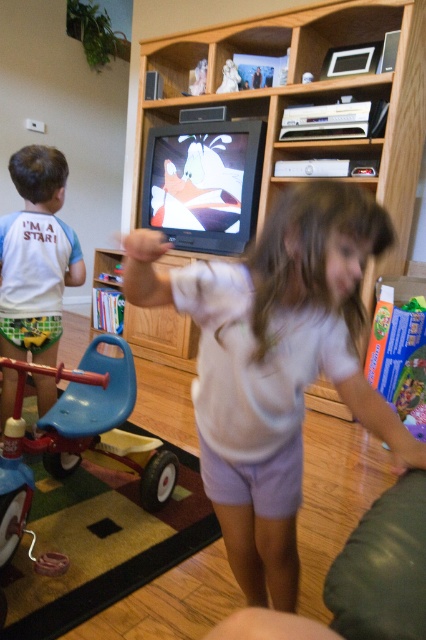
Is blue plastic tricycle at lower left positioned behind white cotton shirt at left?

No, blue plastic tricycle at lower left is in front of white cotton shirt at left.

Is blue plastic tricycle at lower left to the right of white cotton shirt at left from the viewer's perspective?

Indeed, blue plastic tricycle at lower left is positioned on the right side of white cotton shirt at left.

Find the location of `blue plastic tricycle at lower left`. blue plastic tricycle at lower left is located at coordinates (60, 435).

Does point (379, 435) lie behind point (317, 40)?

No, (379, 435) is closer to viewer.

Is white cotton shirt at center thinner than wooden entertainment center at center?

Yes, white cotton shirt at center is thinner than wooden entertainment center at center.

Locate an element on the screen. white cotton shirt at center is located at coordinates (275, 364).

Where is `white cotton shirt at center`? The height and width of the screenshot is (640, 426). white cotton shirt at center is located at coordinates (275, 364).

Is point (259, 502) positioned after point (8, 419)?

That is False.

Between white cotton shirt at center and blue plastic tricycle at lower left, which one is positioned lower?

blue plastic tricycle at lower left is lower down.

Between point (344, 234) and point (68, 426), which one is positioned in front?

Point (344, 234)

The width and height of the screenshot is (426, 640). Identify the location of white cotton shirt at center. (275, 364).